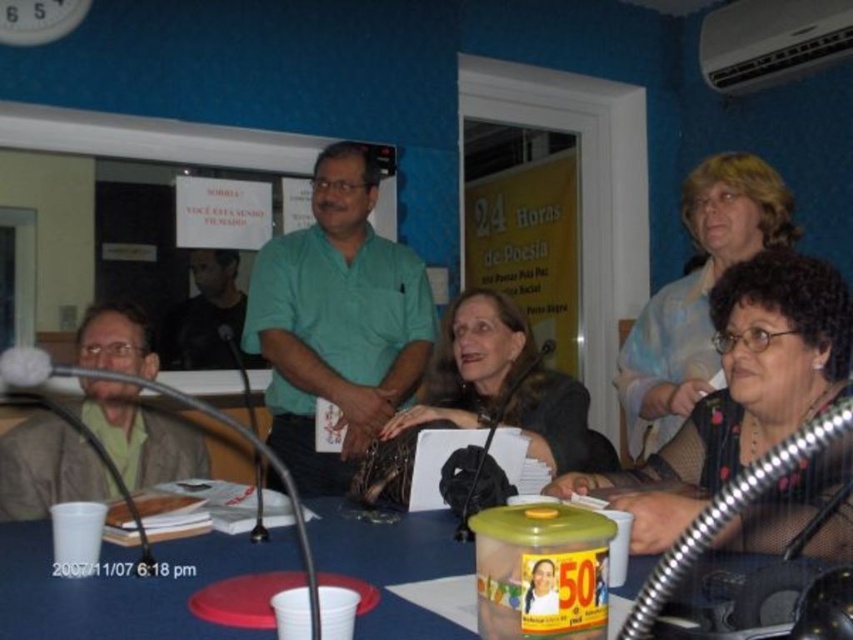
You are organizing a charity event and need to decide which of the two items, the matte blue blouse at upper right or the matte black jacket at center, can fit into a donation box that has a width of 30 cm. Based on their sizes, which item is more likely to fit?

The matte blue blouse at upper right has a smaller width than the matte black jacket at center, so it is more likely to fit into the donation box with a 30 cm width limit.

You are standing at the entrance of the conference room and want to approach the green cotton shirt at center and the blue plastic table at center. Which object will you reach first as you walk towards them?

The green cotton shirt at center will be reached first because it is closer to you than the blue plastic table at center, which is further away.

You are a photographer setting up for a group photo. You need to position yourself so that the blue plastic table at center and the matte blue blouse at upper right are both in frame. Based on their positions, which object should be placed to the left when framing the shot?

The blue plastic table at center is to the left of the matte blue blouse at upper right, so when framing the shot, the blue plastic table at center should be positioned to the left side of the frame to include both objects.